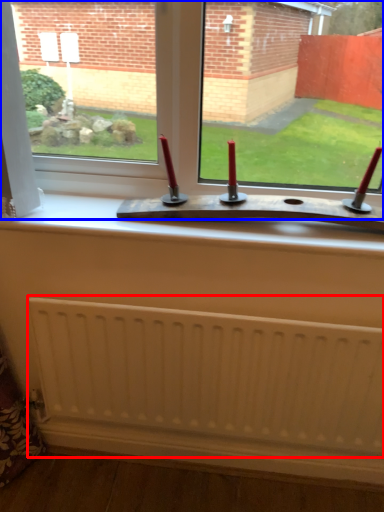
Question: Among these objects, which one is nearest to the camera, radiator (highlighted by a red box) or window (highlighted by a blue box)?

Choices:
 (A) radiator
 (B) window

Answer: (B)